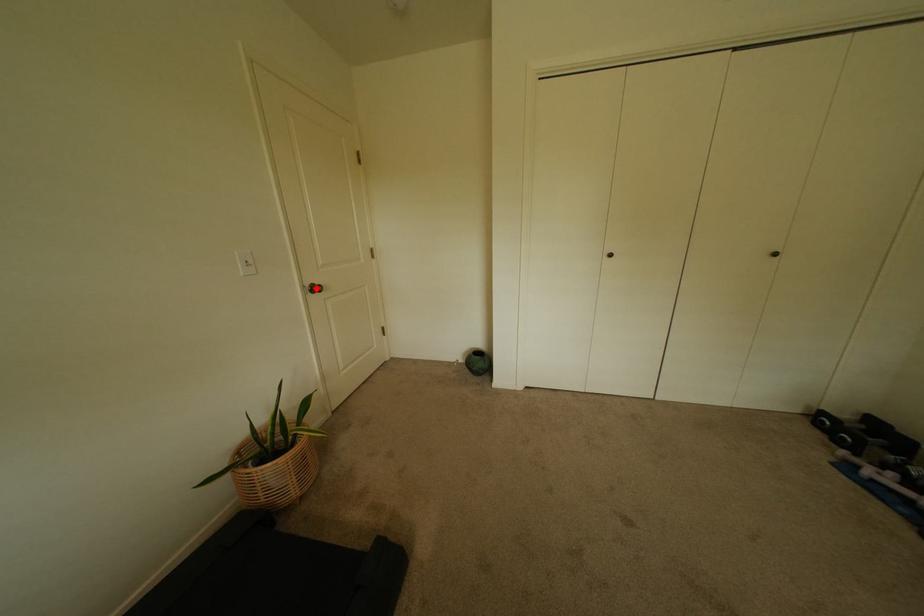
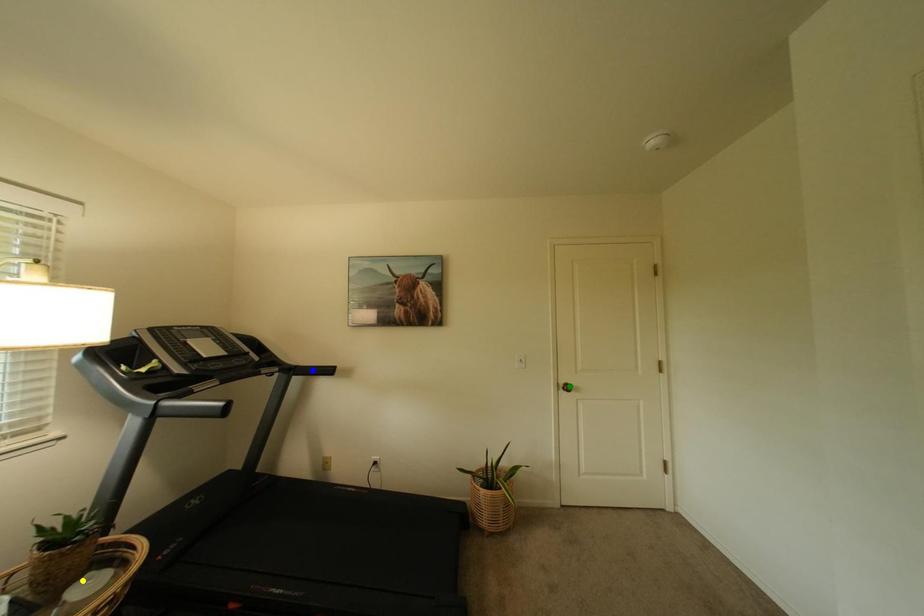
Question: I am providing you with two images of the same scene from different viewpoints. A red point is marked on the first image. You are given multiple points on the second image. Which point in image 2 represents the same 3d spot as the red point in image 1?

Choices:
 (A) blue point
 (B) green point
 (C) yellow point

Answer: (B)